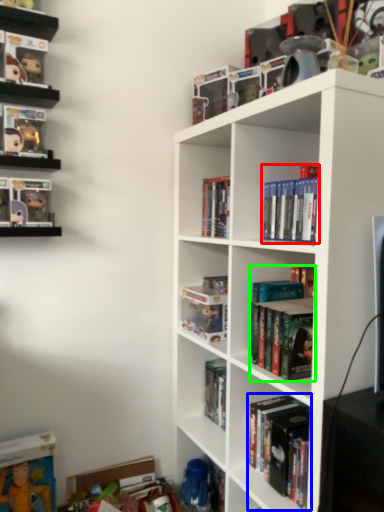
Question: Considering the real-world distances, which object is farthest from book (highlighted by a red box)? book (highlighted by a blue box) or book (highlighted by a green box)?

Choices:
 (A) book
 (B) book

Answer: (A)